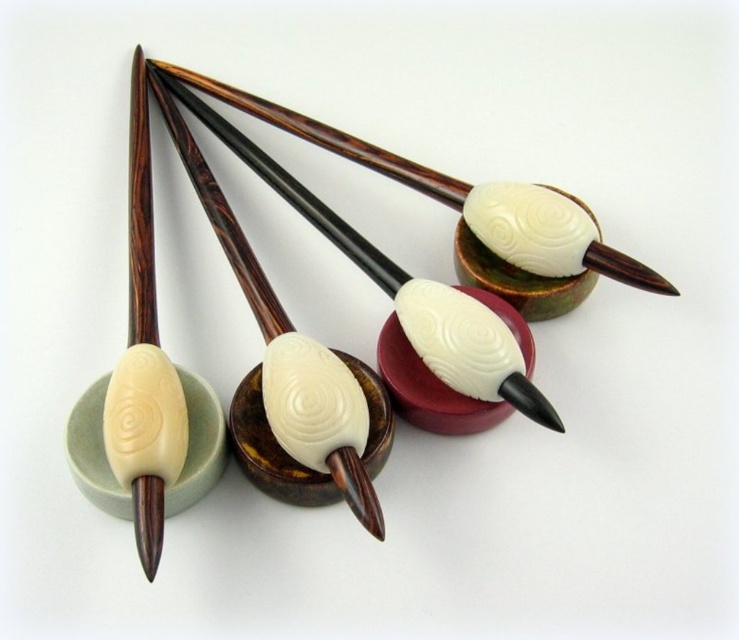
You are standing in front of the image and want to locate the matte brown bowl at center. What are the coordinates of its position?

The coordinates of the matte brown bowl at center are at point (270, 452).

You are standing in a room with a set of four wooden tools displayed on circular bases. Each tool has a dark wooden handle and a small rounded object at the end. You notice a point marked at coordinates (270, 452). What object is located at that point?

The point at coordinates (270, 452) corresponds to the location of the matte brown bowl at center.